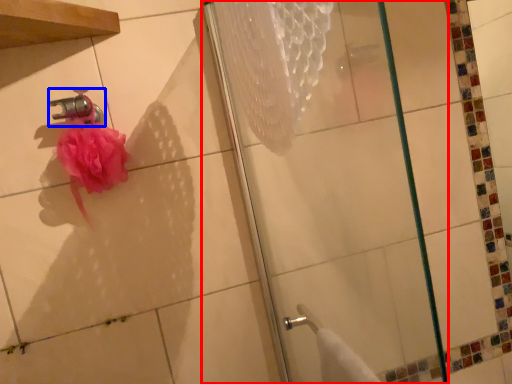
Question: Among these objects, which one is nearest to the camera, shower (highlighted by a red box) or faucet (highlighted by a blue box)?

Choices:
 (A) shower
 (B) faucet

Answer: (A)